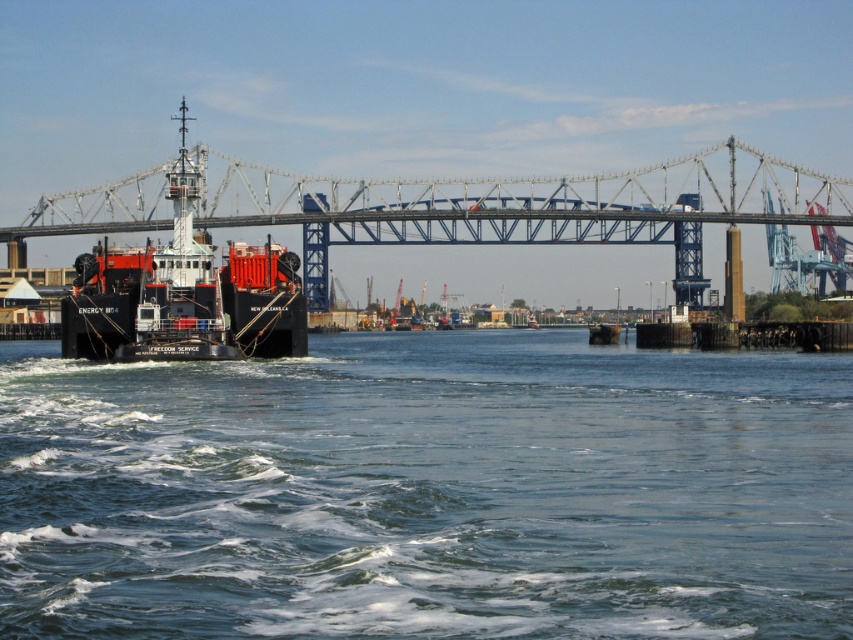
You are a boat captain navigating through the harbor and see the clear blue water at lower center and the metal bridge at center. Which object is located lower in the scene?

The clear blue water at lower center is located below the metal bridge at center, so it is lower in the scene.

You are a drone operator trying to navigate between two points in the harbor scene. The first point is at coordinates point (120, 182) and the second is at point (105, 304). Which point is closer to your current position as you fly over the scene?

Point (120, 182) is closer to your current position because it is further to the viewer than point (105, 304), meaning it is nearer in the scene.

You are a marine biologist observing the harbor. You need to determine if the clear blue water at lower center can accommodate the matte black ship at left in terms of width. Based on the scene, what is your conclusion?

The clear blue water at lower center is wider than the matte black ship at left, so it can accommodate the ship in terms of width.